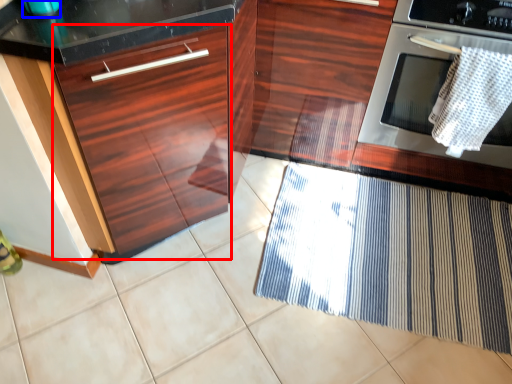
Question: Among these objects, which one is nearest to the camera, drawer (highlighted by a red box) or appliance (highlighted by a blue box)?

Choices:
 (A) drawer
 (B) appliance

Answer: (A)